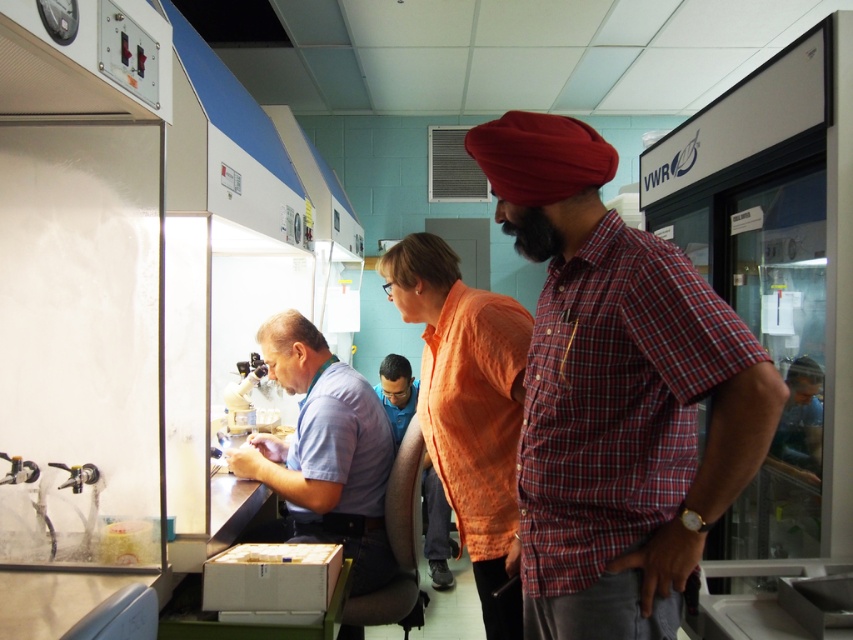
Question: Estimate the real-world distances between objects in this image. Which object is farther from the light blue shirt at center?

Choices:
 (A) blue shirt at center
 (B) orange fabric shirt at center
 (C) red plaid shirt at center
 (D) blue fabric shirt at center

Answer: (D)

Question: In this image, where is red plaid shirt at center located relative to blue shirt at center?

Choices:
 (A) left
 (B) right

Answer: (B)

Question: Which object is the closest to the orange fabric shirt at center?

Choices:
 (A) light blue shirt at center
 (B) blue fabric shirt at center
 (C) red plaid shirt at center
 (D) blue shirt at center

Answer: (C)

Question: Which point appears closest to the camera in this image?

Choices:
 (A) (358, 440)
 (B) (558, 147)
 (C) (436, 499)
 (D) (467, 324)

Answer: (B)

Question: Does light blue shirt at center have a lesser width compared to blue fabric shirt at center?

Choices:
 (A) yes
 (B) no

Answer: (B)

Question: Is light blue shirt at center closer to camera compared to blue fabric shirt at center?

Choices:
 (A) yes
 (B) no

Answer: (A)